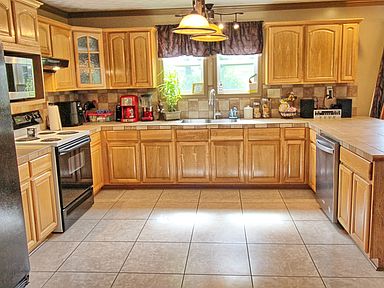
Locate an element on the screen. The width and height of the screenshot is (384, 288). oven is located at coordinates (77, 177).